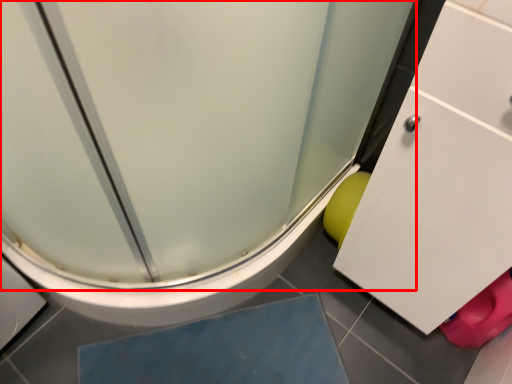
Question: From the image's perspective, what is the correct spatial relationship of screen door (annotated by the red box) in relation to slate?

Choices:
 (A) above
 (B) below

Answer: (A)